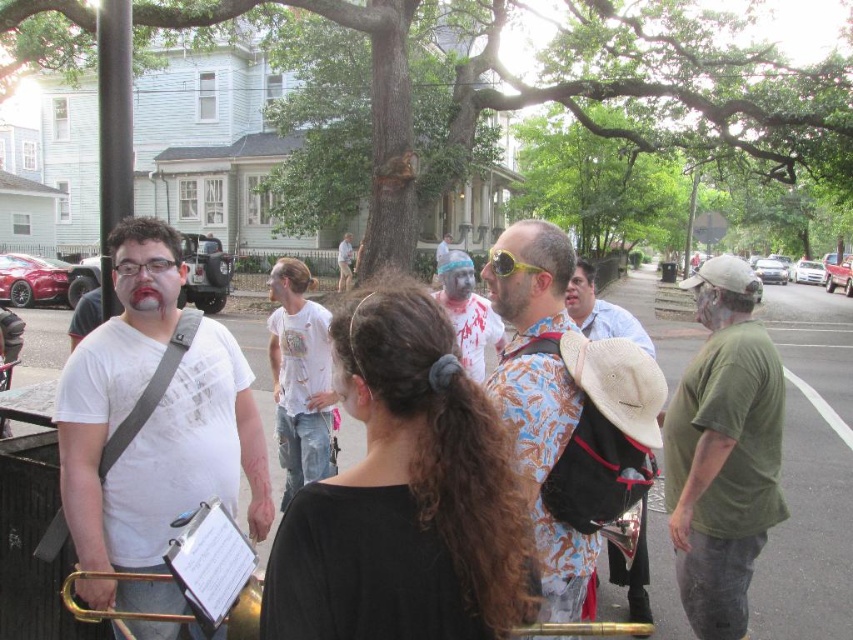
Which is more to the left, green cotton shirt at right or floral-patterned shirt at center?

From the viewer's perspective, floral-patterned shirt at center appears more on the left side.

Between point (698, 312) and point (506, 408), which one is positioned in front?

Point (506, 408) is more forward.

Where is `green cotton shirt at right`? green cotton shirt at right is located at coordinates (723, 451).

Looking at this image, is the position of green cotton shirt at right less distant than that of white cotton t-shirt at center?

Yes, green cotton shirt at right is in front of white cotton t-shirt at center.

Between point (772, 400) and point (299, 323), which one is positioned in front?

Positioned in front is point (772, 400).

Between point (772, 500) and point (317, 387), which one is positioned in front?

Point (772, 500) is more forward.

At what (x,y) coordinates should I click in order to perform the action: click on green cotton shirt at right. Please return your answer as a coordinate pair (x, y). The width and height of the screenshot is (853, 640). Looking at the image, I should click on (723, 451).

Which is in front, point (686, 435) or point (258, 605)?

Point (258, 605) is in front.

Between green cotton shirt at right and gold brass trumpet at lower left, which one has more height?

With more height is green cotton shirt at right.

This screenshot has height=640, width=853. Describe the element at coordinates (723, 451) in the screenshot. I see `green cotton shirt at right` at that location.

This screenshot has height=640, width=853. In order to click on green cotton shirt at right in this screenshot , I will do `click(723, 451)`.